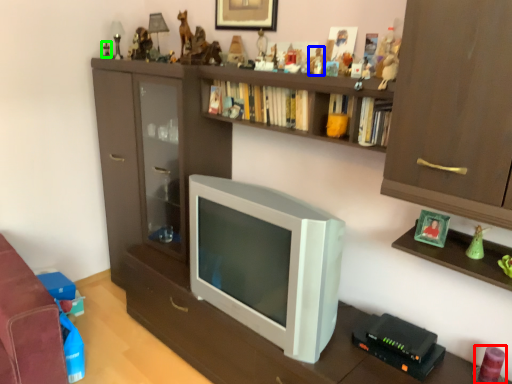
Question: Which object is the closest to the toy (highlighted by a red box)? Choose among these: toy (highlighted by a blue box) or toy (highlighted by a green box).

Choices:
 (A) toy
 (B) toy

Answer: (A)